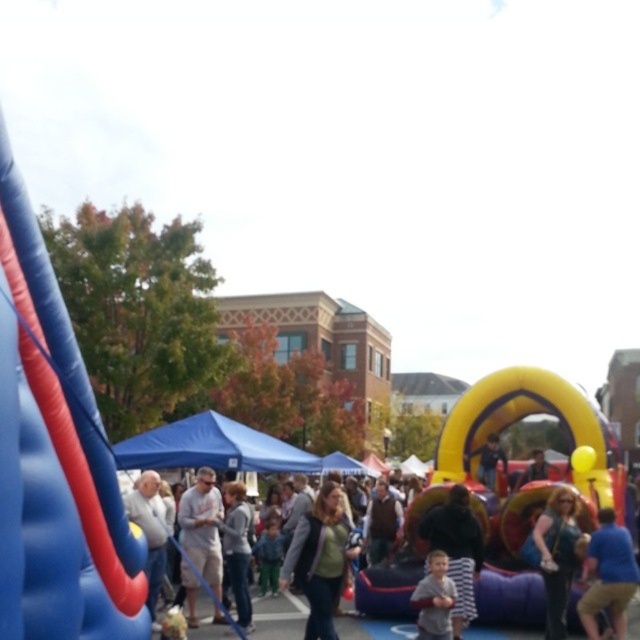
Does gray fabric shirt at center appear on the left side of gray cotton shirt at center?

Indeed, gray fabric shirt at center is positioned on the left side of gray cotton shirt at center.

Image resolution: width=640 pixels, height=640 pixels. Identify the location of gray fabric shirt at center. click(x=202, y=528).

Identify the location of gray fabric shirt at center. Image resolution: width=640 pixels, height=640 pixels. (202, 528).

Is striped fabric shirt at center below gray fabric shirt at center?

Incorrect, striped fabric shirt at center is not positioned below gray fabric shirt at center.

Which is in front, point (444, 502) or point (189, 532)?

Positioned in front is point (444, 502).

Is point (470, 563) in front of point (205, 481)?

Yes, it is in front of point (205, 481).

Where is `striped fabric shirt at center`? striped fabric shirt at center is located at coordinates (456, 548).

Is green fabric jacket at center taller than shiny blue purse at center?

Indeed, green fabric jacket at center has a greater height compared to shiny blue purse at center.

Which is behind, point (323, 600) or point (554, 618)?

Point (554, 618)

Find the location of a particular element. This screenshot has width=640, height=640. green fabric jacket at center is located at coordinates (321, 557).